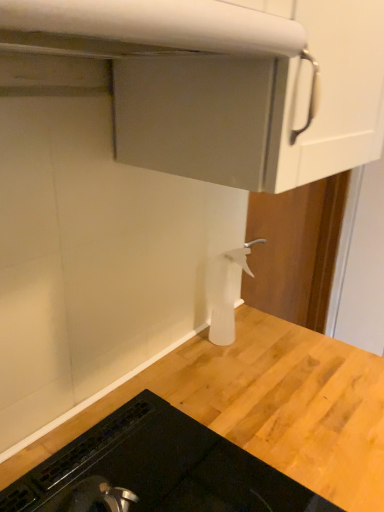
Question: From a real-world perspective, is black glass stovetop at lower left above or below white plastic spray bottle at center?

Choices:
 (A) below
 (B) above

Answer: (A)

Question: From the image's perspective, relative to white plastic spray bottle at center, is black glass stovetop at lower left above or below?

Choices:
 (A) above
 (B) below

Answer: (B)

Question: Estimate the real-world distances between objects in this image. Which object is farther from the white matte exhaust hood at upper center?

Choices:
 (A) white plastic spray bottle at center
 (B) black glass stovetop at lower left

Answer: (B)

Question: Which object is positioned farthest from the black glass stovetop at lower left?

Choices:
 (A) white matte exhaust hood at upper center
 (B) white plastic spray bottle at center

Answer: (A)